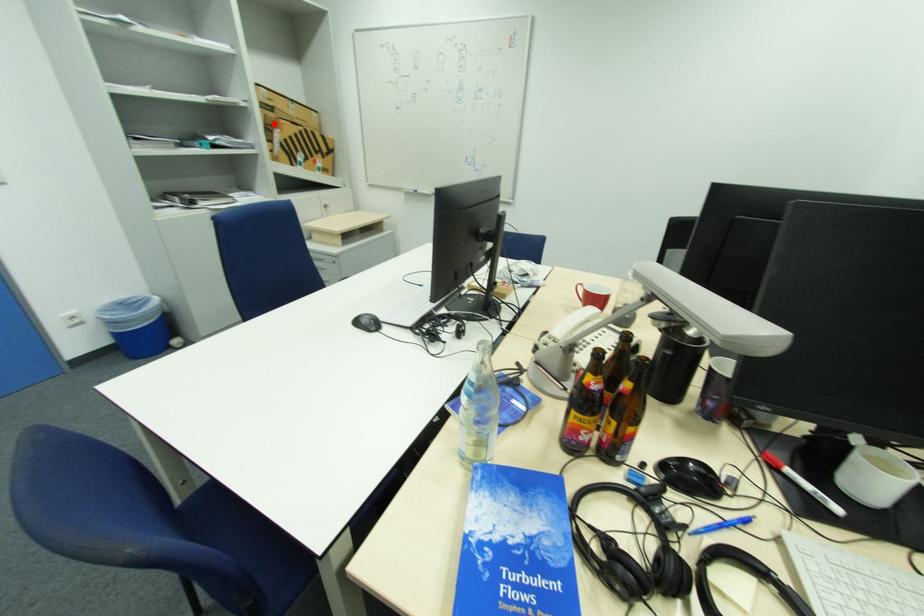
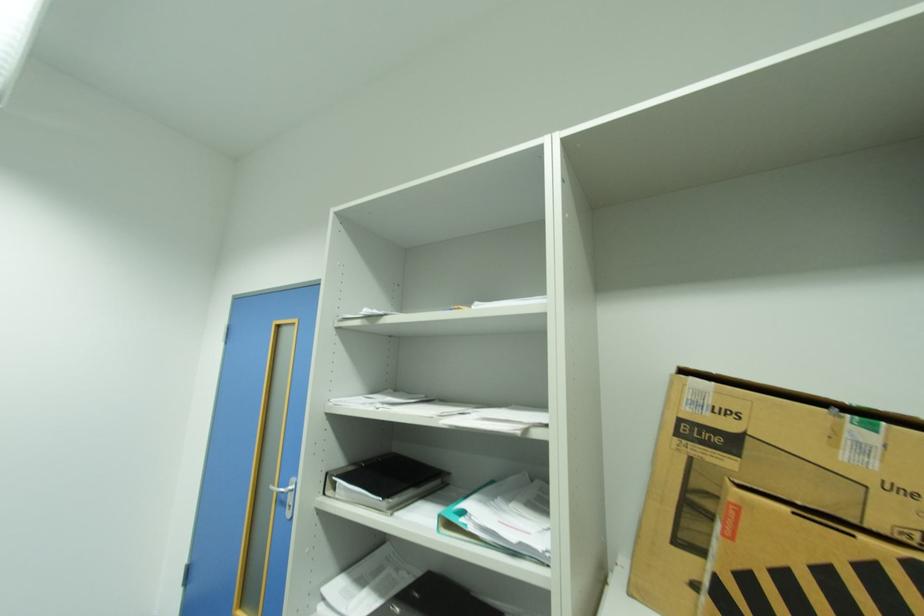
The point at the highlighted location is marked in the first image. Where is the corresponding point in the second image?

(700, 487)